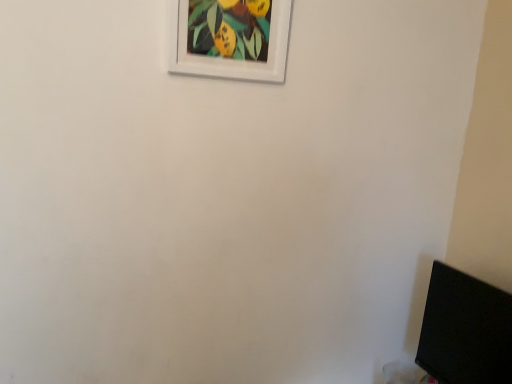
Question: Is black matte computer monitor at lower right aimed at white matte picture frame at upper center?

Choices:
 (A) yes
 (B) no

Answer: (B)

Question: Is black matte computer monitor at lower right in front of white matte picture frame at upper center?

Choices:
 (A) no
 (B) yes

Answer: (B)

Question: Is black matte computer monitor at lower right bigger than white matte picture frame at upper center?

Choices:
 (A) no
 (B) yes

Answer: (B)

Question: Is black matte computer monitor at lower right oriented away from white matte picture frame at upper center?

Choices:
 (A) no
 (B) yes

Answer: (A)

Question: Is black matte computer monitor at lower right far away from white matte picture frame at upper center?

Choices:
 (A) no
 (B) yes

Answer: (A)

Question: Is black matte computer monitor at lower right next to white matte picture frame at upper center?

Choices:
 (A) yes
 (B) no

Answer: (B)

Question: Is white matte picture frame at upper center surrounding black matte computer monitor at lower right?

Choices:
 (A) yes
 (B) no

Answer: (B)

Question: Is white matte picture frame at upper center bigger than black matte computer monitor at lower right?

Choices:
 (A) no
 (B) yes

Answer: (A)

Question: Is white matte picture frame at upper center outside black matte computer monitor at lower right?

Choices:
 (A) yes
 (B) no

Answer: (A)

Question: Is white matte picture frame at upper center wider than black matte computer monitor at lower right?

Choices:
 (A) no
 (B) yes

Answer: (A)

Question: Are white matte picture frame at upper center and black matte computer monitor at lower right located far from each other?

Choices:
 (A) yes
 (B) no

Answer: (B)

Question: Is white matte picture frame at upper center smaller than black matte computer monitor at lower right?

Choices:
 (A) yes
 (B) no

Answer: (A)

Question: Is white matte picture frame at upper center to the left or to the right of black matte computer monitor at lower right in the image?

Choices:
 (A) right
 (B) left

Answer: (B)